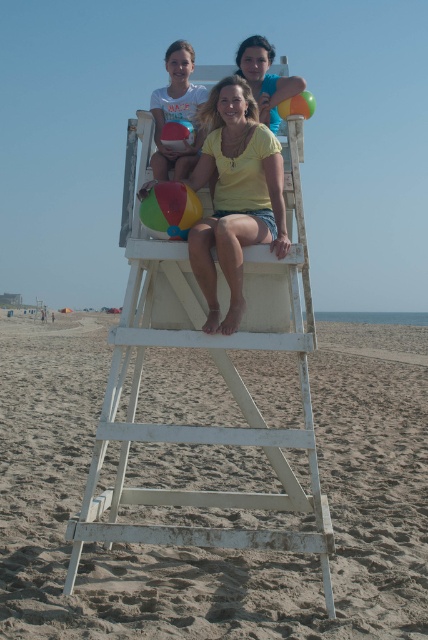
Question: In this image, where is white wooden lifeguard chair at center located relative to yellow matte shirt at center?

Choices:
 (A) left
 (B) right

Answer: (A)

Question: Which point is closer to the camera?

Choices:
 (A) (272, 122)
 (B) (250, 163)

Answer: (B)

Question: Can you confirm if white wooden lifeguard chair at center is positioned above matte yellow shirt at upper center?

Choices:
 (A) no
 (B) yes

Answer: (A)

Question: Which point appears closest to the camera in this image?

Choices:
 (A) (247, 154)
 (B) (256, 77)

Answer: (A)

Question: Which point is closer to the camera?

Choices:
 (A) white wooden lifeguard chair at center
 (B) matte yellow shirt at upper center
 (C) yellow matte shirt at center

Answer: (A)

Question: Is yellow matte shirt at center wider than matte yellow shirt at upper center?

Choices:
 (A) yes
 (B) no

Answer: (B)